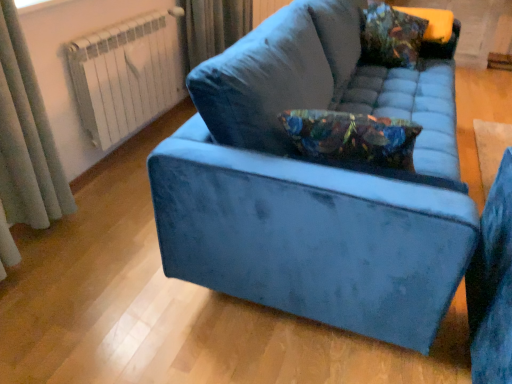
The width and height of the screenshot is (512, 384). Find the location of `free spot below gray fabric curtain at left (from a real-world perspective)`. free spot below gray fabric curtain at left (from a real-world perspective) is located at coordinates [x=55, y=228].